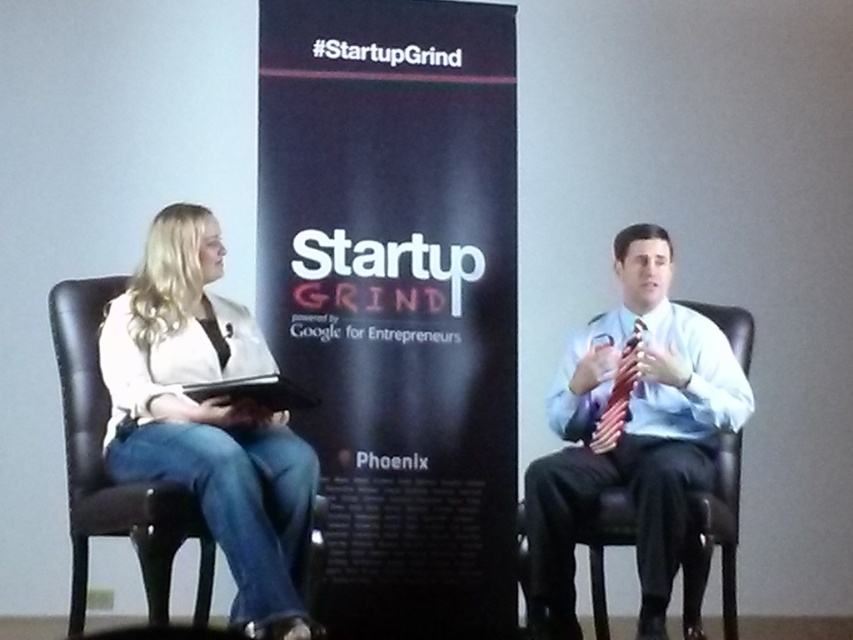
You are attending a Startup Grind event in Phoenix and notice two attendees. The first is wearing a white matte jacket at left, and the second has a red satin tie at right. From your perspective at the back of the room, which clothing item is positioned more to the left?

The white matte jacket at left is positioned more to the left than the red satin tie at right.

You are standing in the Startup Grind event venue in Phoenix and see two points marked in the scene. The first point is at coordinates point (364, 93) and the second is at point (178, 272). Which point is closer to you?

Point (364, 93) is further to the viewer than point (178, 272), so the second point is closer to you.

You are organizing a presentation and need to place a decorative item between the black paper at center and the white matte jacket at left. Given their widths, which object should you place closer to the narrower one to maintain balance?

Since the black paper at center is wider than the white matte jacket at left, you should place the decorative item closer to the white matte jacket at left to balance the composition.